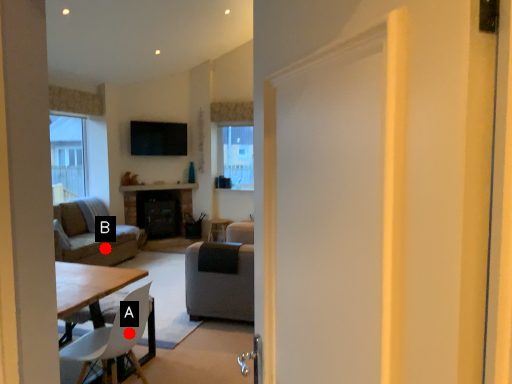
Question: Two points are circled on the image, labeled by A and B beside each circle. Which point is farther from the camera taking this photo?

Choices:
 (A) A is further
 (B) B is further

Answer: (B)